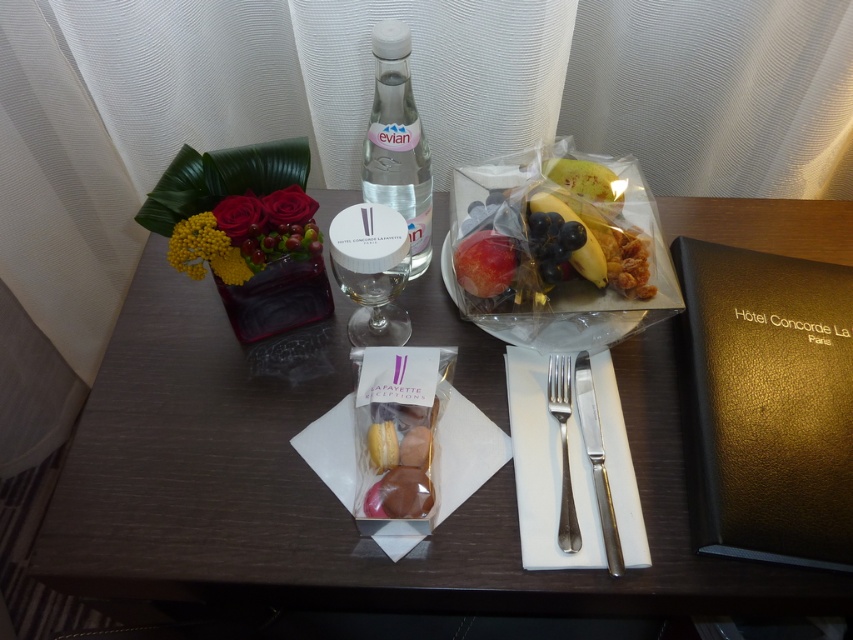
Question: Which object appears closest to the camera in this image?

Choices:
 (A) red glossy apple at center
 (B) transparent glass bottle at center

Answer: (B)

Question: Does transparent glass wine glass at center have a lesser width compared to red glossy apple at center?

Choices:
 (A) no
 (B) yes

Answer: (A)

Question: Can you confirm if wooden table at center is smaller than satin silver fork at center?

Choices:
 (A) no
 (B) yes

Answer: (A)

Question: Which object is closer to the camera taking this photo?

Choices:
 (A) wooden table at center
 (B) polished silver fork and knife at center

Answer: (B)

Question: Is polished silver fork and knife at center wider than satin silver fork at center?

Choices:
 (A) no
 (B) yes

Answer: (A)

Question: Which point is closer to the camera?

Choices:
 (A) red glossy apple at center
 (B) translucent plastic bag of fruit at center
 (C) satin silver fork at center
 (D) polished silver fork and knife at center

Answer: (D)